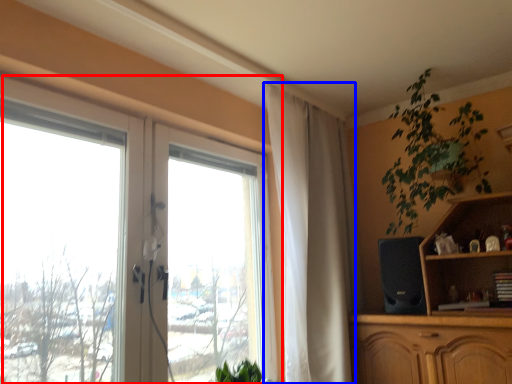
Question: Which object is further to the camera taking this photo, window (highlighted by a red box) or curtain (highlighted by a blue box)?

Choices:
 (A) window
 (B) curtain

Answer: (B)